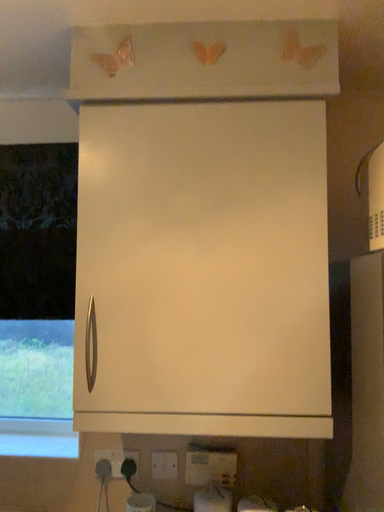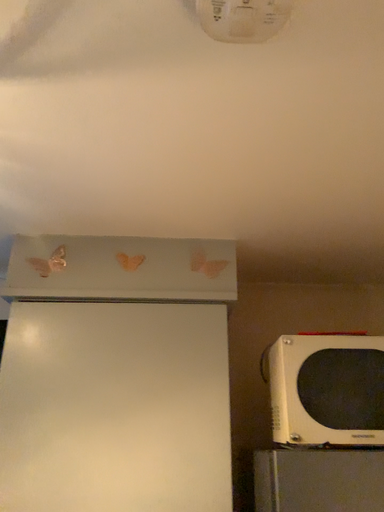
Question: How did the camera likely rotate when shooting the video?

Choices:
 (A) rotated downward
 (B) rotated upward

Answer: (B)